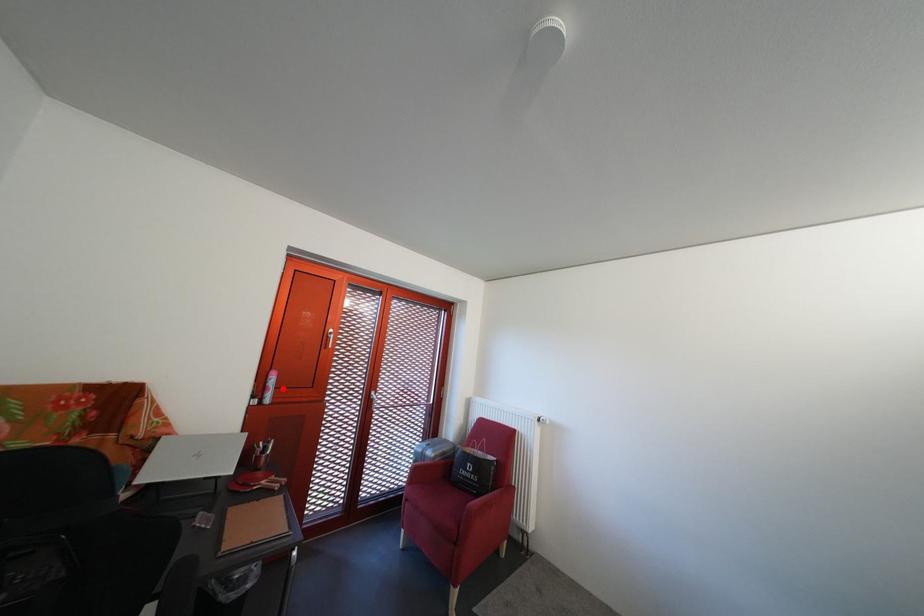
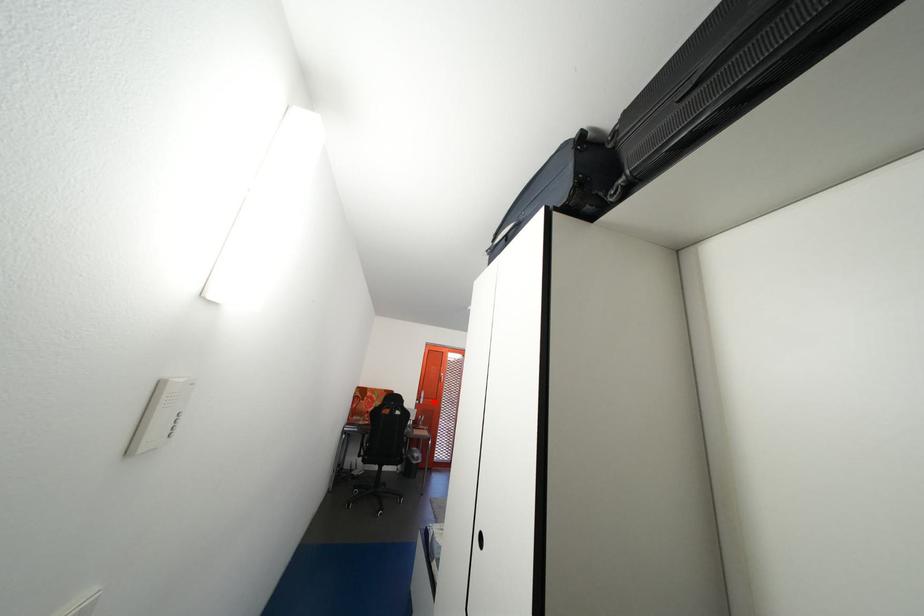
I am providing you with two images of the same scene from different viewpoints. A red point is marked on the first image and another point is marked on the second image. Is the red point in image1 aligned with the point shown in image2?

Yes